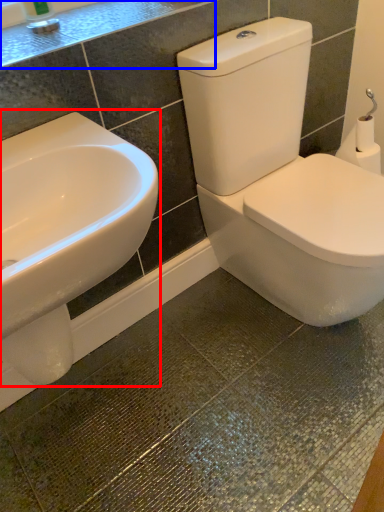
Question: Which of the following is the closest to the observer, sink (highlighted by a red box) or counter top (highlighted by a blue box)?

Choices:
 (A) sink
 (B) counter top

Answer: (A)